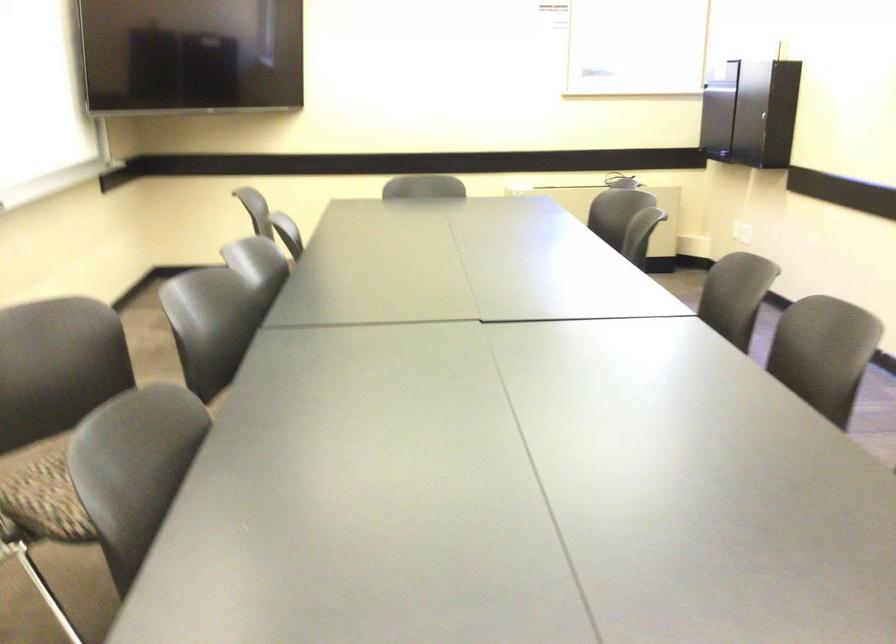
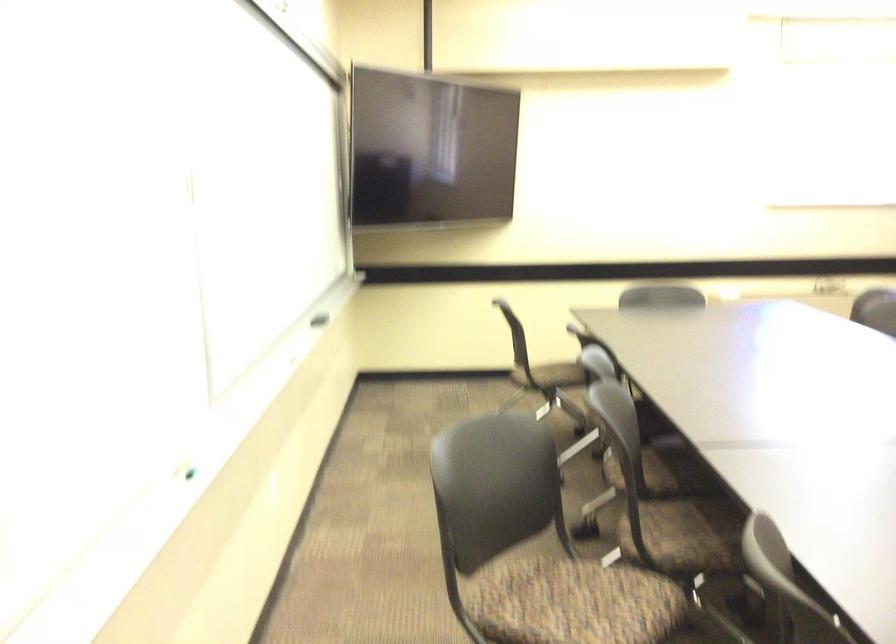
Question: The images are taken continuously from a first-person perspective. In which direction are you moving?

Choices:
 (A) Left
 (B) Right
 (C) Forward
 (D) Backward

Answer: (A)